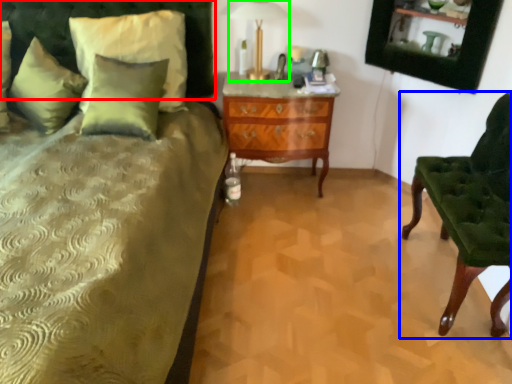
Question: Which object is positioned closest to headboard (highlighted by a red box)? Select from chair (highlighted by a blue box) and table lamp (highlighted by a green box).

Choices:
 (A) chair
 (B) table lamp

Answer: (B)